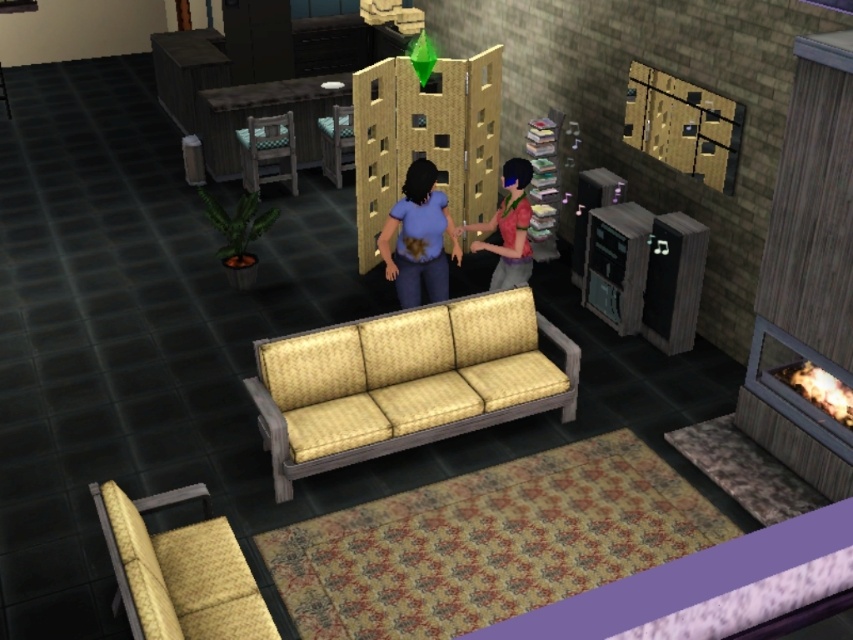
Is yellow textured couch at center bigger than wooden chair at center?

Yes, yellow textured couch at center is bigger than wooden chair at center.

Who is more distant from viewer, (277, 461) or (329, 148)?

Point (329, 148)

Does point (339, 369) come in front of point (339, 129)?

Yes, it is in front of point (339, 129).

Where is `yellow textured couch at center`? yellow textured couch at center is located at coordinates (404, 381).

Which of these two, yellow textured couch at center or matte pink shirt at center, stands taller?

Standing taller between the two is yellow textured couch at center.

Which of these two, yellow textured couch at center or matte pink shirt at center, stands shorter?

matte pink shirt at center

Is point (465, 356) farther from viewer compared to point (508, 172)?

No, it is in front of (508, 172).

Where is `yellow textured couch at center`? The image size is (853, 640). yellow textured couch at center is located at coordinates (404, 381).

Between matte pink shirt at center and wooden chair at left, which one appears on the right side from the viewer's perspective?

matte pink shirt at center is more to the right.

In the scene shown: Can you confirm if matte pink shirt at center is shorter than wooden chair at left?

No.

Image resolution: width=853 pixels, height=640 pixels. Identify the location of matte pink shirt at center. (508, 228).

Where is `matte pink shirt at center`? The height and width of the screenshot is (640, 853). matte pink shirt at center is located at coordinates (508, 228).